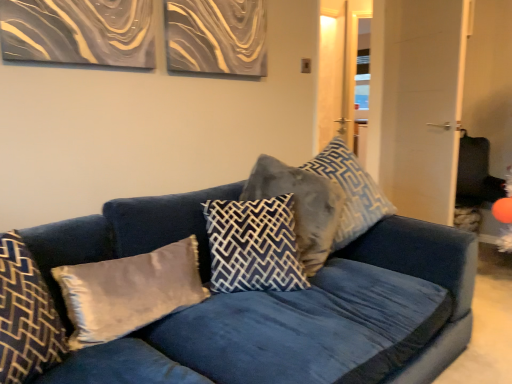
Question: Considering the positions of point (418, 278) and point (215, 289), is point (418, 278) closer or farther from the camera than point (215, 289)?

Choices:
 (A) closer
 (B) farther

Answer: (B)

Question: Is velvet blue couch at center inside the boundaries of dark blue velvet pillow at center, the 3th pillow in the right-to-left sequence, or outside?

Choices:
 (A) inside
 (B) outside

Answer: (B)

Question: Based on their relative distances, which object is nearer to the satin gray pillow at center, the second pillow from the left?

Choices:
 (A) dark blue velvet pillow at center, which is the third pillow in left-to-right order
 (B) velvet blue couch at center
 (C) velvet blue pillow at center, the first pillow positioned from the right
 (D) velvet gray pillow at center, marked as the 4th pillow in a left-to-right arrangement
 (E) velvet gray pillow at left, the fifth pillow when ordered from right to left

Answer: (E)

Question: Based on their relative distances, which object is farther from the velvet gray pillow at left, the fifth pillow when ordered from right to left?

Choices:
 (A) velvet gray pillow at center, which is the 2th pillow in right-to-left order
 (B) velvet blue couch at center
 (C) satin gray pillow at center, arranged as the 4th pillow when viewed from the right
 (D) dark blue velvet pillow at center, which is the third pillow in left-to-right order
 (E) velvet blue pillow at center, acting as the 5th pillow starting from the left

Answer: (E)